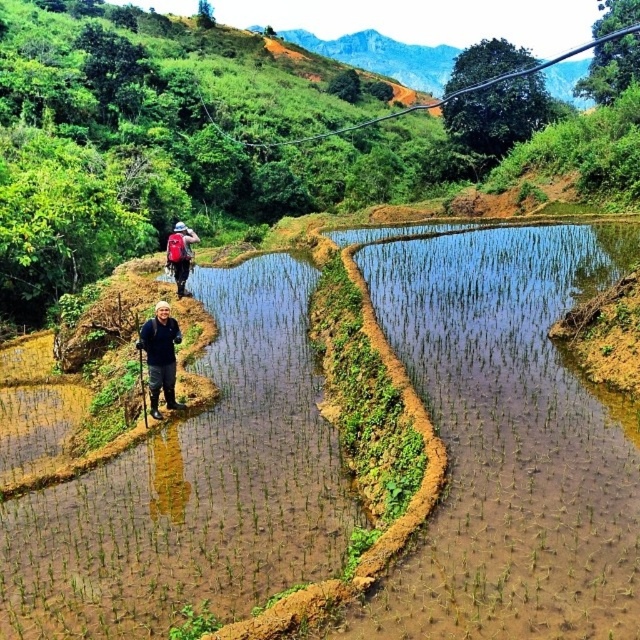
Question: Does dark blue jeans at center appear under matte red backpack at center?

Choices:
 (A) no
 (B) yes

Answer: (B)

Question: Which object is the farthest from the brown soil at center?

Choices:
 (A) matte red backpack at center
 (B) dark blue jeans at center

Answer: (A)

Question: Which of the following is the closest to the observer?

Choices:
 (A) (474, 285)
 (B) (179, 266)
 (C) (152, 390)

Answer: (C)

Question: Where is brown soil at center located in relation to matte red backpack at center in the image?

Choices:
 (A) left
 (B) right

Answer: (B)

Question: Which of the following is the closest to the observer?

Choices:
 (A) (268, 346)
 (B) (170, 397)

Answer: (B)

Question: Considering the relative positions of brown soil at center and dark blue jeans at center in the image provided, where is brown soil at center located with respect to dark blue jeans at center?

Choices:
 (A) above
 (B) below

Answer: (B)